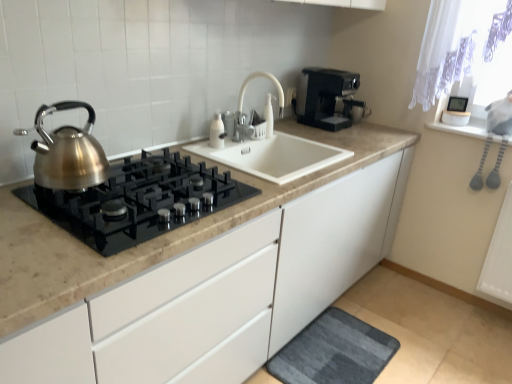
In order to click on white matte faucet at center in this screenshot , I will do `click(253, 114)`.

The width and height of the screenshot is (512, 384). What are the coordinates of `satin metallic gas stove at left` in the screenshot? It's located at (138, 200).

The width and height of the screenshot is (512, 384). Find the location of `black plastic coffee maker at upper right`. black plastic coffee maker at upper right is located at coordinates (327, 98).

Locate an element on the screen. The width and height of the screenshot is (512, 384). dark gray textured bath mat at lower center is located at coordinates (334, 352).

Find the location of a particular element. This screenshot has width=512, height=384. gas stove in front of the dark gray textured bath mat at lower center is located at coordinates (138, 200).

Can you confirm if dark gray textured bath mat at lower center is smaller than satin metallic gas stove at left?

Correct, dark gray textured bath mat at lower center occupies less space than satin metallic gas stove at left.

From a real-world perspective, is dark gray textured bath mat at lower center physically above satin metallic gas stove at left?

No, from a real-world perspective, dark gray textured bath mat at lower center is not over satin metallic gas stove at left

Is dark gray textured bath mat at lower center completely or partially outside of satin metallic gas stove at left?

dark gray textured bath mat at lower center lies outside satin metallic gas stove at left's area.

Would you say satin metallic gas stove at left is to the left or to the right of dark gray textured bath mat at lower center in the picture?

From the image, it's evident that satin metallic gas stove at left is to the left of dark gray textured bath mat at lower center.

Which is in front, satin metallic gas stove at left or dark gray textured bath mat at lower center?

satin metallic gas stove at left is in front.

Could you measure the distance between satin metallic gas stove at left and dark gray textured bath mat at lower center?

satin metallic gas stove at left and dark gray textured bath mat at lower center are 38.73 inches apart.

From the image's perspective, which one is positioned lower, satin metallic gas stove at left or dark gray textured bath mat at lower center?

dark gray textured bath mat at lower center, from the image's perspective.

Is black plastic coffee maker at upper right wider than satin metallic gas stove at left?

In fact, black plastic coffee maker at upper right might be narrower than satin metallic gas stove at left.

Image resolution: width=512 pixels, height=384 pixels. I want to click on gas stove lying in front of the black plastic coffee maker at upper right, so click(138, 200).

Is the position of black plastic coffee maker at upper right more distant than that of satin metallic gas stove at left?

Yes, it is.

Can you confirm if black plastic coffee maker at upper right is taller than satin metallic gas stove at left?

Yes, black plastic coffee maker at upper right is taller than satin metallic gas stove at left.

At what (x,y) coordinates should I click in order to perform the action: click on bath mat below the brushed metal kettle at left (from a real-world perspective). Please return your answer as a coordinate pair (x, y). The image size is (512, 384). Looking at the image, I should click on (334, 352).

Which is behind, point (347, 324) or point (81, 169)?

The point (347, 324) is behind.

Does dark gray textured bath mat at lower center have a lesser width compared to brushed metal kettle at left?

No, dark gray textured bath mat at lower center is not thinner than brushed metal kettle at left.

Is dark gray textured bath mat at lower center to the right of brushed metal kettle at left from the viewer's perspective?

Yes, dark gray textured bath mat at lower center is to the right of brushed metal kettle at left.

From a real-world perspective, which object rests below the other?

In real-world perspective, satin metallic gas stove at left is lower.

From their relative heights in the image, would you say satin metallic gas stove at left is taller or shorter than black plastic coffee maker at upper right?

In the image, satin metallic gas stove at left appears to be shorter than black plastic coffee maker at upper right.

Is satin metallic gas stove at left in front of or behind black plastic coffee maker at upper right in the image?

Visually, satin metallic gas stove at left is located in front of black plastic coffee maker at upper right.

From the image's perspective, who appears lower, satin metallic gas stove at left or black plastic coffee maker at upper right?

satin metallic gas stove at left.

Considering the positions of objects white matte faucet at center and dark gray textured bath mat at lower center in the image provided, who is more to the right, white matte faucet at center or dark gray textured bath mat at lower center?

dark gray textured bath mat at lower center.

Is white matte faucet at center far from dark gray textured bath mat at lower center?

Yes, white matte faucet at center is far from dark gray textured bath mat at lower center.

Is white matte faucet at center thinner than dark gray textured bath mat at lower center?

Indeed, white matte faucet at center has a lesser width compared to dark gray textured bath mat at lower center.

From the image's perspective, who appears lower, black plastic coffee maker at upper right or white matte faucet at center?

From the image's view, white matte faucet at center is below.

Are black plastic coffee maker at upper right and white matte faucet at center located far from each other?

No, black plastic coffee maker at upper right is in close proximity to white matte faucet at center.

Is black plastic coffee maker at upper right surrounding white matte faucet at center?

A: No, white matte faucet at center is located outside of black plastic coffee maker at upper right.

At what (x,y) coordinates should I click in order to perform the action: click on bath mat below the satin metallic gas stove at left (from a real-world perspective). Please return your answer as a coordinate pair (x, y). Looking at the image, I should click on (334, 352).

Image resolution: width=512 pixels, height=384 pixels. What are the coordinates of `bath mat behind the satin metallic gas stove at left` in the screenshot? It's located at (334, 352).

When comparing their distances from dark gray textured bath mat at lower center, does white matte faucet at center or brushed metal kettle at left seem closer?

Based on the image, white matte faucet at center appears to be nearer to dark gray textured bath mat at lower center.

Estimate the real-world distances between objects in this image. Which object is closer to dark gray textured bath mat at lower center, brushed metal kettle at left or satin metallic gas stove at left?

satin metallic gas stove at left.

Looking at the image, which one is located further to white matte faucet at center, satin metallic gas stove at left or dark gray textured bath mat at lower center?

dark gray textured bath mat at lower center is further to white matte faucet at center.

Estimate the real-world distances between objects in this image. Which object is further from white matte faucet at center, dark gray textured bath mat at lower center or satin metallic gas stove at left?

dark gray textured bath mat at lower center is positioned further to the anchor white matte faucet at center.

Which object lies nearer to the anchor point dark gray textured bath mat at lower center, black plastic coffee maker at upper right or white matte faucet at center?

white matte faucet at center lies closer to dark gray textured bath mat at lower center than the other object.

From the image, which object appears to be farther from brushed metal kettle at left, satin metallic gas stove at left or white matte faucet at center?

The object further to brushed metal kettle at left is white matte faucet at center.

Considering their positions, is white matte faucet at center positioned closer to dark gray textured bath mat at lower center than black plastic coffee maker at upper right?

The object closer to dark gray textured bath mat at lower center is white matte faucet at center.

Looking at the image, which one is located closer to brushed metal kettle at left, satin metallic gas stove at left or black plastic coffee maker at upper right?

Based on the image, satin metallic gas stove at left appears to be nearer to brushed metal kettle at left.

The width and height of the screenshot is (512, 384). What are the coordinates of `gas stove that lies between white matte faucet at center and dark gray textured bath mat at lower center from top to bottom` in the screenshot? It's located at (138, 200).

You are a GUI agent. You are given a task and a screenshot of the screen. Output one action in this format:
    pyautogui.click(x=<x>, y=<y>)
    Task: Click on the tap between black plastic coffee maker at upper right and dark gray textured bath mat at lower center vertically
    
    Given the screenshot: What is the action you would take?
    pyautogui.click(x=253, y=114)

Locate an element on the screen. The image size is (512, 384). gas stove between brushed metal kettle at left and dark gray textured bath mat at lower center in the up-down direction is located at coordinates (138, 200).

This screenshot has height=384, width=512. Identify the location of kettle between black plastic coffee maker at upper right and dark gray textured bath mat at lower center vertically. (68, 152).